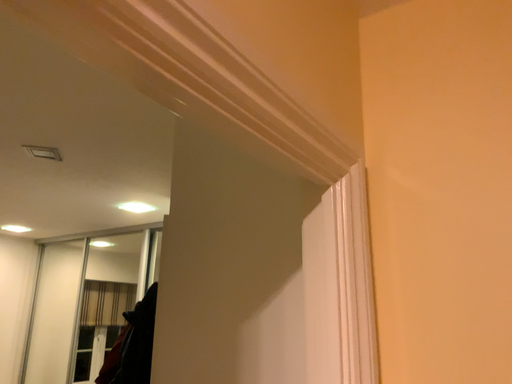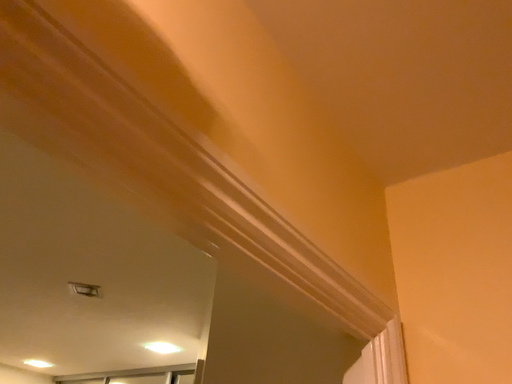
Question: How did the camera likely rotate when shooting the video?

Choices:
 (A) rotated upward
 (B) rotated downward

Answer: (A)